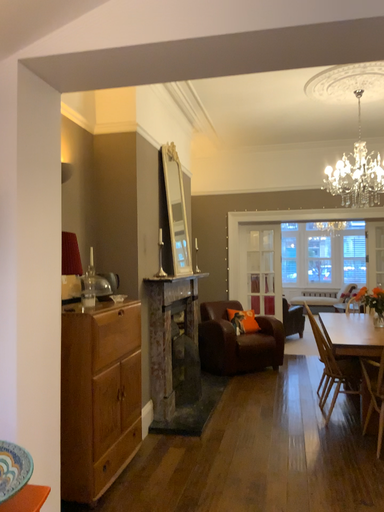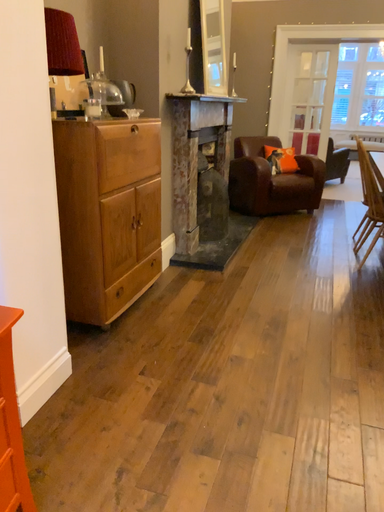
Question: Which way did the camera rotate in the video?

Choices:
 (A) rotated upward
 (B) rotated downward

Answer: (B)